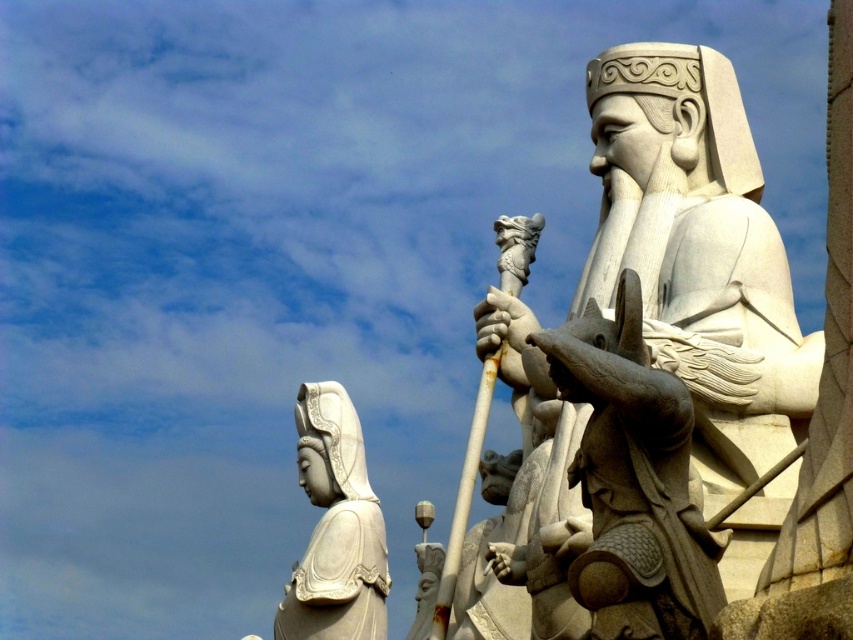
Question: Is white stone statue at right further to camera compared to white stone statue at lower left?

Choices:
 (A) no
 (B) yes

Answer: (A)

Question: Can you confirm if white stone statue at right is positioned above white stone statue at lower left?

Choices:
 (A) no
 (B) yes

Answer: (B)

Question: Among these objects, which one is farthest from the camera?

Choices:
 (A) white stone statue at right
 (B) white stone statue at lower left

Answer: (B)

Question: Among these objects, which one is farthest from the camera?

Choices:
 (A) white stone statue at lower left
 (B) white stone statue at right

Answer: (A)

Question: Is white stone statue at right further to the viewer compared to white stone statue at lower left?

Choices:
 (A) yes
 (B) no

Answer: (B)